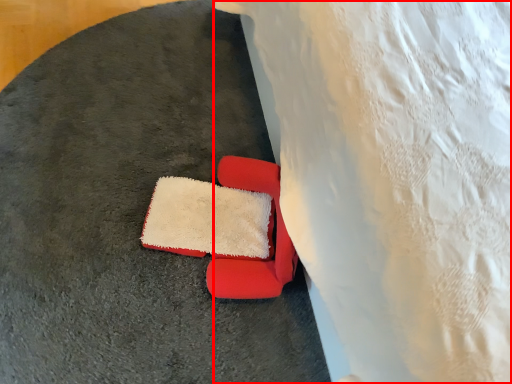
Question: Where is sheet (annotated by the red box) located in relation to chair in the image?

Choices:
 (A) right
 (B) left

Answer: (A)